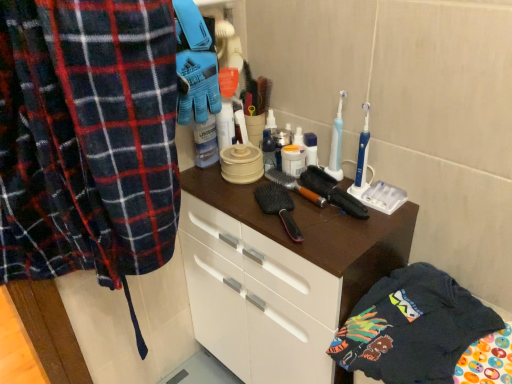
Locate an element on the screen. This screenshot has height=384, width=512. empty space that is ontop of brown matte cabinet at center is located at coordinates (301, 204).